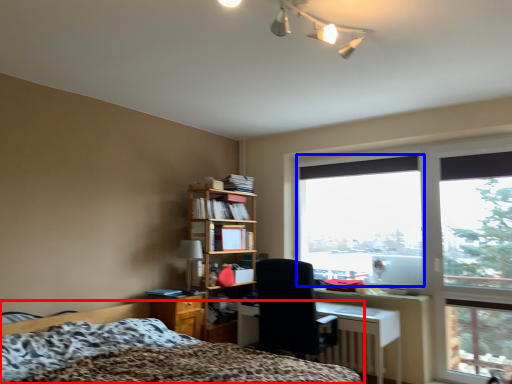
Question: Among these objects, which one is farthest to the camera, bed (highlighted by a red box) or window screen (highlighted by a blue box)?

Choices:
 (A) bed
 (B) window screen

Answer: (B)